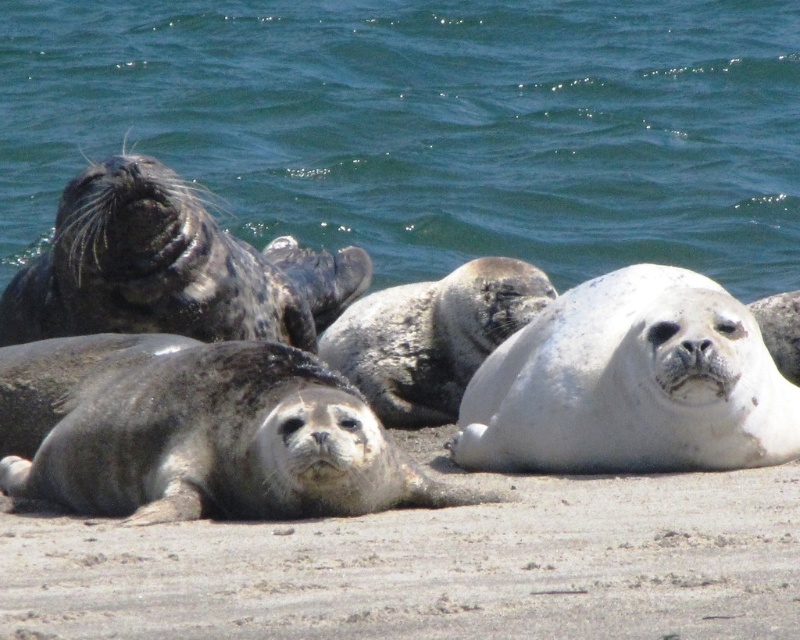
Question: Which point is farther to the camera?

Choices:
 (A) (780, 259)
 (B) (122, 596)

Answer: (A)

Question: Is green water at upper left to the left of sandy brown at lower center from the viewer's perspective?

Choices:
 (A) no
 (B) yes

Answer: (B)

Question: Among these objects, which one is nearest to the camera?

Choices:
 (A) green water at upper left
 (B) sandy brown at lower center

Answer: (B)

Question: Can you confirm if green water at upper left is positioned above sandy brown at lower center?

Choices:
 (A) no
 (B) yes

Answer: (B)

Question: Is green water at upper left bigger than sandy brown at lower center?

Choices:
 (A) yes
 (B) no

Answer: (A)